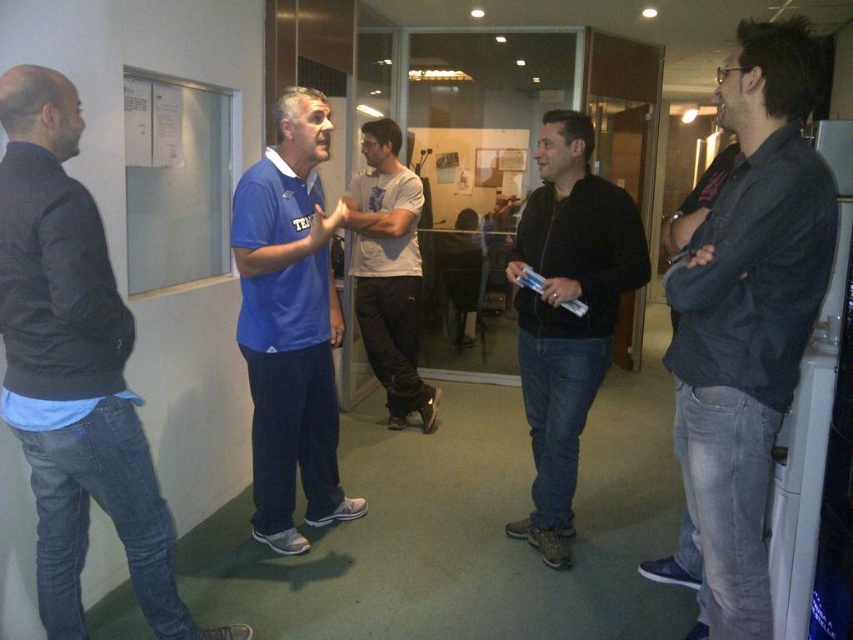
Question: Is black matte jacket at center closer to camera compared to light gray cotton t-shirt at center?

Choices:
 (A) yes
 (B) no

Answer: (A)

Question: Does dark gray denim jeans at right appear under blue matte shirt at center?

Choices:
 (A) no
 (B) yes

Answer: (B)

Question: Is dark blue jeans at left thinner than black matte jacket at center?

Choices:
 (A) no
 (B) yes

Answer: (A)

Question: Which object appears closest to the camera in this image?

Choices:
 (A) light gray cotton t-shirt at center
 (B) black matte jacket at center
 (C) dark gray denim jeans at right
 (D) dark blue jeans at left

Answer: (C)

Question: Which of these objects is positioned farthest from the blue matte shirt at center?

Choices:
 (A) dark gray denim jeans at right
 (B) black matte jacket at center
 (C) dark blue jeans at left

Answer: (A)

Question: Which point is closer to the camera?

Choices:
 (A) (294, 396)
 (B) (24, 170)
 (C) (769, 275)

Answer: (C)